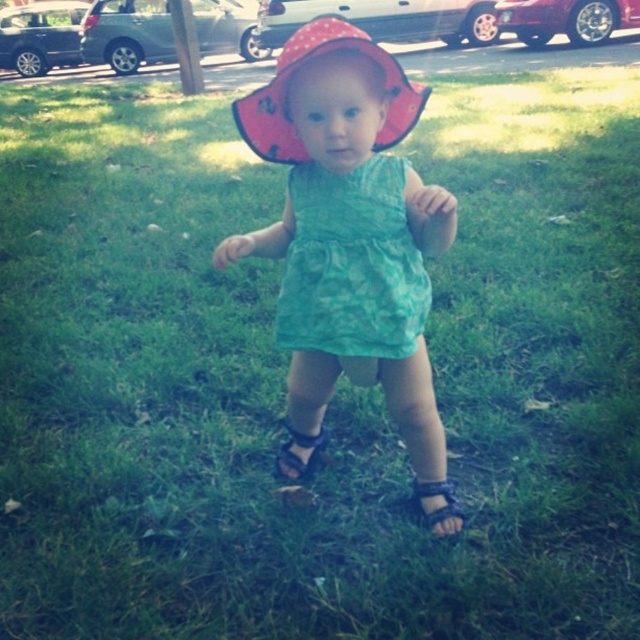
You are a photographer trying to capture the child in the scene. You want to ensure both the matte green dress at center and the black fabric sandal at lower center are clearly visible in your photo. Based on their positions, which object should you focus on first to ensure both are in frame?

The matte green dress at center is to the left of black fabric sandal at lower center. To ensure both are in frame, focus on the matte green dress at center first since it is positioned to the left, allowing the sandal to naturally fall within the same view.